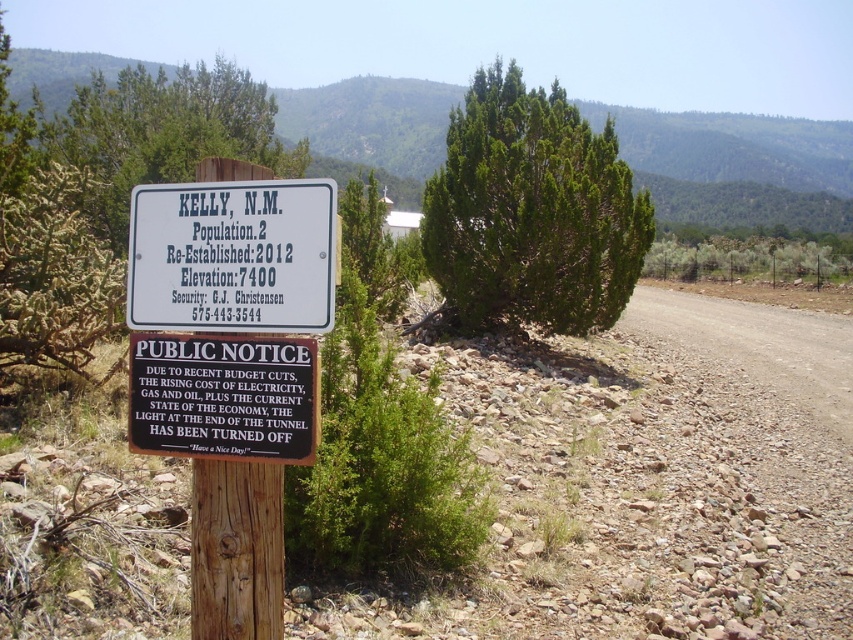
Question: Which of the following is the closest to the observer?

Choices:
 (A) brown gravel road at right
 (B) brown wooden sign at lower left

Answer: (B)

Question: Does brown wooden sign at lower left have a larger size compared to wooden post at center?

Choices:
 (A) yes
 (B) no

Answer: (A)

Question: Does green coniferous tree at center appear under brown gravel road at right?

Choices:
 (A) yes
 (B) no

Answer: (B)

Question: Based on their relative distances, which object is farther from the brown wooden sign at lower left?

Choices:
 (A) wooden post at center
 (B) white plastic sign at center
 (C) brown gravel road at right

Answer: (C)

Question: Which point is closer to the camera taking this photo?

Choices:
 (A) (247, 388)
 (B) (426, 212)

Answer: (A)

Question: Does brown gravel road at right have a smaller size compared to white plastic sign at center?

Choices:
 (A) yes
 (B) no

Answer: (B)